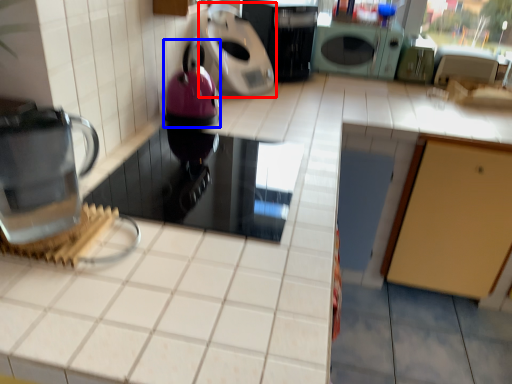
Question: Which of the following is the farthest to the observer, kitchen appliance (highlighted by a red box) or appliance (highlighted by a blue box)?

Choices:
 (A) kitchen appliance
 (B) appliance

Answer: (A)